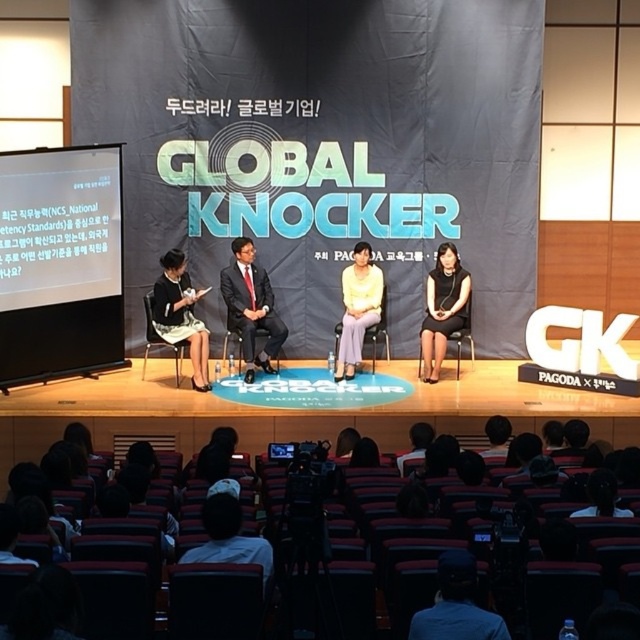
Question: Considering the real-world distances, which object is closest to the black fabric dress at center?

Choices:
 (A) matte black dress at left
 (B) light yellow fabric blouse at center

Answer: (B)

Question: Considering the relative positions of matte black dress at left and light yellow fabric blouse at center in the image provided, where is matte black dress at left located with respect to light yellow fabric blouse at center?

Choices:
 (A) left
 (B) right

Answer: (A)

Question: Estimate the real-world distances between objects in this image. Which object is farther from the striped fabric shirt at lower center?

Choices:
 (A) metallic silver chair at center
 (B) white matte screen at left
 (C) dark suit at center

Answer: (B)

Question: Does matte black dress at left come behind black fabric dress at center?

Choices:
 (A) no
 (B) yes

Answer: (A)

Question: Observing the image, what is the correct spatial positioning of blue fabric cap at center in reference to striped fabric shirt at lower center?

Choices:
 (A) below
 (B) above

Answer: (A)

Question: Which object appears closest to the camera in this image?

Choices:
 (A) striped fabric shirt at lower center
 (B) light yellow fabric blouse at center
 (C) dark suit at center

Answer: (A)